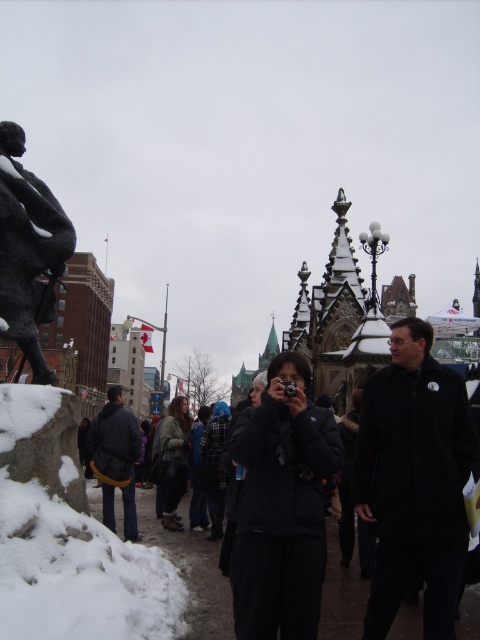
Is black matte jacket at center to the right of bronze statue at left from the viewer's perspective?

Yes, black matte jacket at center is to the right of bronze statue at left.

Between point (237, 442) and point (29, 205), which one is positioned behind?

The point (237, 442) is behind.

Is point (260, 536) positioned behind point (26, 230)?

No, (260, 536) is in front of (26, 230).

I want to click on black matte jacket at center, so click(x=282, y=506).

Does black matte coat at center have a larger size compared to dark gray jacket at center?

Yes, black matte coat at center is bigger than dark gray jacket at center.

Who is lower down, black matte coat at center or dark gray jacket at center?

dark gray jacket at center

Which is in front, point (402, 566) or point (110, 442)?

Point (402, 566) is more forward.

The width and height of the screenshot is (480, 640). I want to click on black matte coat at center, so click(x=415, y=481).

Can you confirm if black matte jacket at center is positioned above black fabric jacket at center?

Yes, black matte jacket at center is above black fabric jacket at center.

The image size is (480, 640). What do you see at coordinates (282, 506) in the screenshot?
I see `black matte jacket at center` at bounding box center [282, 506].

This screenshot has height=640, width=480. In order to click on black matte jacket at center in this screenshot , I will do `click(282, 506)`.